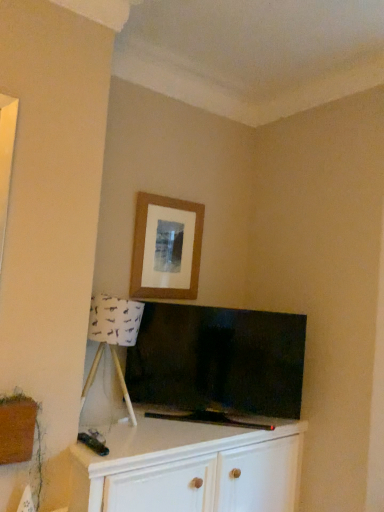
What do you see at coordinates (218, 360) in the screenshot? This screenshot has width=384, height=512. I see `flat-screen tv at center` at bounding box center [218, 360].

In the scene shown: What is the approximate width of wooden picture frame at upper center?

wooden picture frame at upper center is 1.66 inches wide.

This screenshot has width=384, height=512. What do you see at coordinates (189, 469) in the screenshot?
I see `white wood cabinet at lower center` at bounding box center [189, 469].

What is the approximate height of white wood cabinet at lower center?

The height of white wood cabinet at lower center is 74.91 centimeters.

Identify the location of white fabric lampshade at lower left. This screenshot has height=512, width=384. (113, 337).

Looking at this image, considering the sizes of objects flat-screen tv at center and wooden picture frame at upper center in the image provided, who is taller, flat-screen tv at center or wooden picture frame at upper center?

Standing taller between the two is flat-screen tv at center.

Based on the photo, looking at the image, does flat-screen tv at center seem bigger or smaller compared to wooden picture frame at upper center?

flat-screen tv at center is bigger than wooden picture frame at upper center.

Between flat-screen tv at center and wooden picture frame at upper center, which one appears on the left side from the viewer's perspective?

wooden picture frame at upper center is more to the left.

Considering the sizes of objects flat-screen tv at center and wooden picture frame at upper center in the image provided, who is wider, flat-screen tv at center or wooden picture frame at upper center?

flat-screen tv at center.

From the picture: Is white fabric lampshade at lower left placed right next to white wood cabinet at lower center?

No.

Which of these two, white fabric lampshade at lower left or white wood cabinet at lower center, is bigger?

white wood cabinet at lower center is bigger.

Considering the positions of objects white fabric lampshade at lower left and white wood cabinet at lower center in the image provided, who is behind, white fabric lampshade at lower left or white wood cabinet at lower center?

white fabric lampshade at lower left is further away from the camera.

Does white fabric lampshade at lower left have a greater height compared to white wood cabinet at lower center?

In fact, white fabric lampshade at lower left may be shorter than white wood cabinet at lower center.

Who is smaller, white fabric lampshade at lower left or flat-screen tv at center?

With smaller size is white fabric lampshade at lower left.

Is point (134, 413) closer to viewer compared to point (162, 317)?

Yes, it is.

Is white fabric lampshade at lower left spatially inside flat-screen tv at center, or outside of it?

white fabric lampshade at lower left is spatially situated outside flat-screen tv at center.

Is white wood cabinet at lower center positioned behind white fabric lampshade at lower left?

No.

Consider the image. Would you say white fabric lampshade at lower left is part of white wood cabinet at lower center's contents?

Definitely not — white fabric lampshade at lower left is not inside white wood cabinet at lower center.

Considering the sizes of objects white wood cabinet at lower center and white fabric lampshade at lower left in the image provided, who is shorter, white wood cabinet at lower center or white fabric lampshade at lower left?

white fabric lampshade at lower left is shorter.

Is point (283, 484) closer to camera compared to point (131, 403)?

No.

Is white fabric lampshade at lower left facing towards wooden picture frame at upper center?

No, white fabric lampshade at lower left is not oriented towards wooden picture frame at upper center.

Considering the positions of objects white fabric lampshade at lower left and wooden picture frame at upper center in the image provided, who is in front, white fabric lampshade at lower left or wooden picture frame at upper center?

white fabric lampshade at lower left is in front.

Considering the sizes of objects white fabric lampshade at lower left and wooden picture frame at upper center in the image provided, who is shorter, white fabric lampshade at lower left or wooden picture frame at upper center?

wooden picture frame at upper center.

Considering the relative positions of white fabric lampshade at lower left and wooden picture frame at upper center in the image provided, is white fabric lampshade at lower left to the right of wooden picture frame at upper center from the viewer's perspective?

No.

Is white wood cabinet at lower center turned away from flat-screen tv at center?

No, white wood cabinet at lower center's orientation is not away from flat-screen tv at center.

Does point (221, 458) appear closer or farther from the camera than point (216, 308)?

Point (221, 458) is closer to the camera than point (216, 308).

Is white wood cabinet at lower center positioned before flat-screen tv at center?

Yes, it is.

Based on the photo, how distant is white wood cabinet at lower center from flat-screen tv at center?

A distance of 14.99 inches exists between white wood cabinet at lower center and flat-screen tv at center.

How different are the orientations of white wood cabinet at lower center and wooden picture frame at upper center in degrees?

The facing directions of white wood cabinet at lower center and wooden picture frame at upper center are 1.48 degrees apart.

Which object is wider, white wood cabinet at lower center or wooden picture frame at upper center?

Wider between the two is white wood cabinet at lower center.

I want to click on picture frame located behind the white wood cabinet at lower center, so click(166, 248).

Would you say white wood cabinet at lower center is a long distance from wooden picture frame at upper center?

white wood cabinet at lower center is actually quite close to wooden picture frame at upper center.

This screenshot has height=512, width=384. I want to click on picture frame that is on the left side of flat-screen tv at center, so (x=166, y=248).

Find the location of a particular element. cabinetry below the white fabric lampshade at lower left (from a real-world perspective) is located at coordinates (189, 469).

Based on their spatial positions, is wooden picture frame at upper center or white fabric lampshade at lower left closer to flat-screen tv at center?

wooden picture frame at upper center.

Which object lies further to the anchor point flat-screen tv at center, white fabric lampshade at lower left or wooden picture frame at upper center?

Among the two, white fabric lampshade at lower left is located further to flat-screen tv at center.

Looking at the image, which one is located closer to flat-screen tv at center, white wood cabinet at lower center or white fabric lampshade at lower left?

The object closer to flat-screen tv at center is white wood cabinet at lower center.

Which object lies nearer to the anchor point white fabric lampshade at lower left, wooden picture frame at upper center or flat-screen tv at center?

Among the two, flat-screen tv at center is located nearer to white fabric lampshade at lower left.

When comparing their distances from white wood cabinet at lower center, does wooden picture frame at upper center or white fabric lampshade at lower left seem closer?

The object closer to white wood cabinet at lower center is white fabric lampshade at lower left.

From the picture: Based on their spatial positions, is white fabric lampshade at lower left or flat-screen tv at center further from white wood cabinet at lower center?

white fabric lampshade at lower left is positioned further to the anchor white wood cabinet at lower center.

Which object lies nearer to the anchor point white wood cabinet at lower center, flat-screen tv at center or white fabric lampshade at lower left?

Based on the image, flat-screen tv at center appears to be nearer to white wood cabinet at lower center.

Looking at the image, which one is located further to wooden picture frame at upper center, flat-screen tv at center or white fabric lampshade at lower left?

white fabric lampshade at lower left is further to wooden picture frame at upper center.

Image resolution: width=384 pixels, height=512 pixels. I want to click on television between white fabric lampshade at lower left and white wood cabinet at lower center in the vertical direction, so click(218, 360).

You are a GUI agent. You are given a task and a screenshot of the screen. Output one action in this format:
    pyautogui.click(x=<x>, y=<y>)
    Task: Click on the lamp between wooden picture frame at upper center and flat-screen tv at center in the up-down direction
    
    Given the screenshot: What is the action you would take?
    pyautogui.click(x=113, y=337)

You are a GUI agent. You are given a task and a screenshot of the screen. Output one action in this format:
    pyautogui.click(x=<x>, y=<y>)
    Task: Click on the lamp between wooden picture frame at upper center and white wood cabinet at lower center in the up-down direction
    This screenshot has width=384, height=512.
    Given the screenshot: What is the action you would take?
    click(x=113, y=337)

You are a GUI agent. You are given a task and a screenshot of the screen. Output one action in this format:
    pyautogui.click(x=<x>, y=<y>)
    Task: Click on the television between wooden picture frame at upper center and white wood cabinet at lower center vertically
    The width and height of the screenshot is (384, 512).
    Given the screenshot: What is the action you would take?
    coord(218,360)